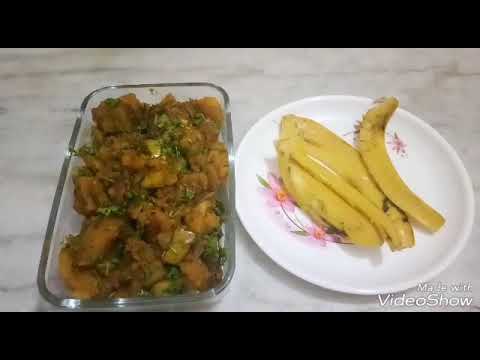
Locate an element on the screen. table is located at coordinates (251, 86).